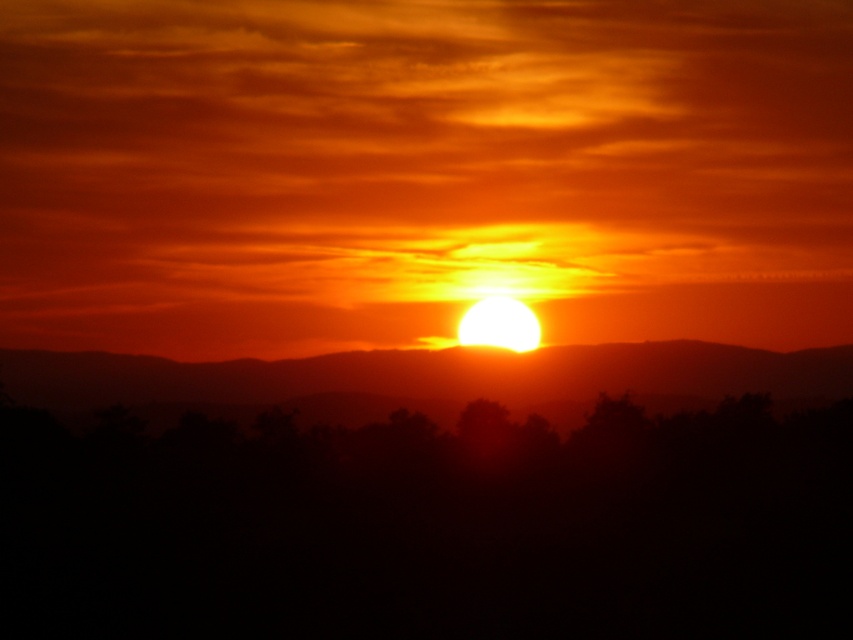
Is point (656, 616) positioned behind point (239, 388)?

That is False.

At what (x,y) coordinates should I click in order to perform the action: click on black matte tree at center. Please return your answer as a coordinate pair (x, y). The width and height of the screenshot is (853, 640). Looking at the image, I should click on (430, 525).

You are a GUI agent. You are given a task and a screenshot of the screen. Output one action in this format:
    pyautogui.click(x=<x>, y=<y>)
    Task: Click on the black matte tree at center
    This screenshot has height=640, width=853.
    Given the screenshot: What is the action you would take?
    pyautogui.click(x=430, y=525)